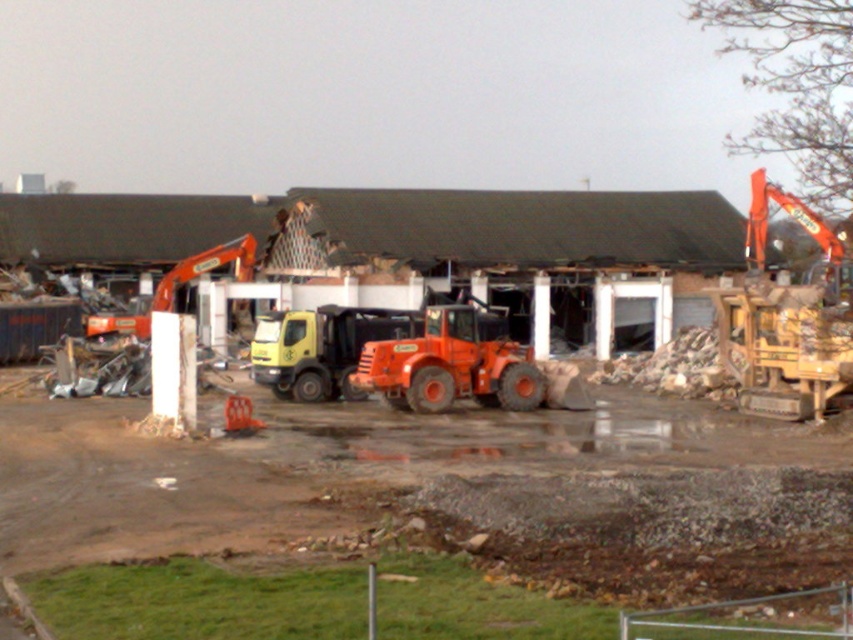
Looking at this image, does orange rubber tractor at center have a smaller size compared to orange metallic excavator at left?

Yes.

Measure the distance between orange rubber tractor at center and camera.

orange rubber tractor at center is 28.88 meters away from camera.

Find the location of a particular element. This screenshot has width=853, height=640. orange rubber tractor at center is located at coordinates (x=450, y=365).